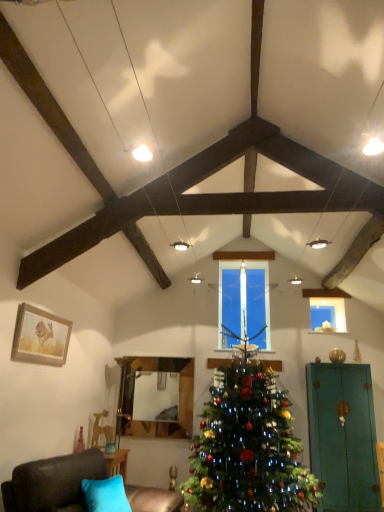
Question: Considering the relative positions of wooden framed picture at left and clear glass candle at center in the image provided, is wooden framed picture at left to the right of clear glass candle at center from the viewer's perspective?

Choices:
 (A) no
 (B) yes

Answer: (A)

Question: Is wooden framed picture at left further to camera compared to clear glass candle at center?

Choices:
 (A) yes
 (B) no

Answer: (B)

Question: Can clear glass candle at center be found inside wooden framed picture at left?

Choices:
 (A) no
 (B) yes

Answer: (A)

Question: From the image's perspective, is wooden framed picture at left on top of clear glass candle at center?

Choices:
 (A) no
 (B) yes

Answer: (B)

Question: Is the depth of wooden framed picture at left less than that of clear glass candle at center?

Choices:
 (A) no
 (B) yes

Answer: (B)

Question: Relative to green matte christmas tree at center, is transparent glass candle at upper center in front or behind?

Choices:
 (A) behind
 (B) front

Answer: (A)

Question: Is transparent glass candle at upper center bigger or smaller than green matte christmas tree at center?

Choices:
 (A) big
 (B) small

Answer: (B)

Question: Visually, is transparent glass candle at upper center positioned to the left or to the right of green matte christmas tree at center?

Choices:
 (A) left
 (B) right

Answer: (B)

Question: Does point (314, 318) appear closer or farther from the camera than point (203, 507)?

Choices:
 (A) closer
 (B) farther

Answer: (B)

Question: Considering the positions of transparent glass candle at upper center and wooden framed picture at left in the image, is transparent glass candle at upper center wider or thinner than wooden framed picture at left?

Choices:
 (A) thin
 (B) wide

Answer: (A)

Question: From a real-world perspective, is transparent glass candle at upper center positioned above or below wooden framed picture at left?

Choices:
 (A) below
 (B) above

Answer: (B)

Question: Is point (324, 306) positioned closer to the camera than point (26, 325)?

Choices:
 (A) closer
 (B) farther

Answer: (B)

Question: In the image, is transparent glass candle at upper center on the left side or the right side of wooden framed picture at left?

Choices:
 (A) right
 (B) left

Answer: (A)

Question: Choose the correct answer: Is teal matte armoire at right inside clear glass candle at center or outside it?

Choices:
 (A) outside
 (B) inside

Answer: (A)

Question: Based on their positions, is teal matte armoire at right located to the left or right of clear glass candle at center?

Choices:
 (A) right
 (B) left

Answer: (A)